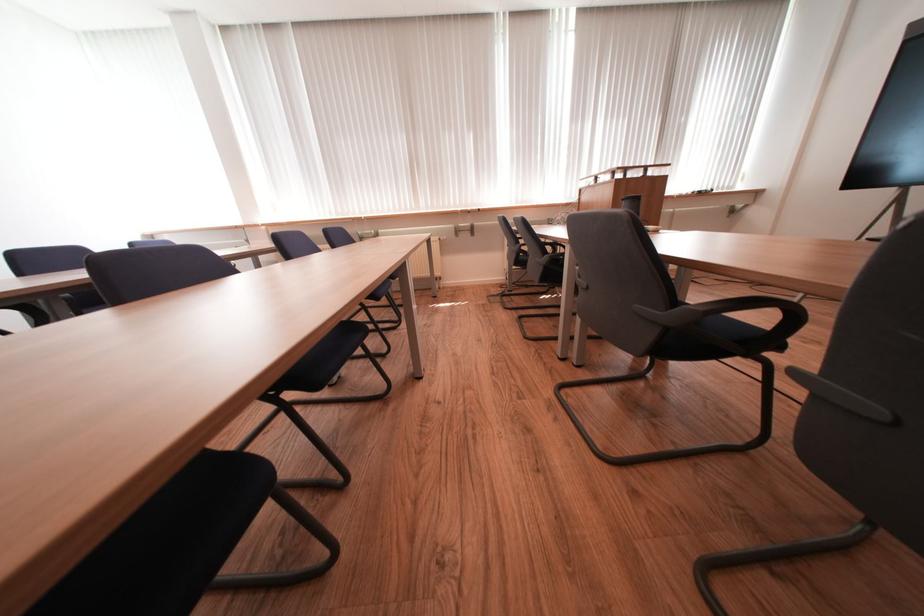
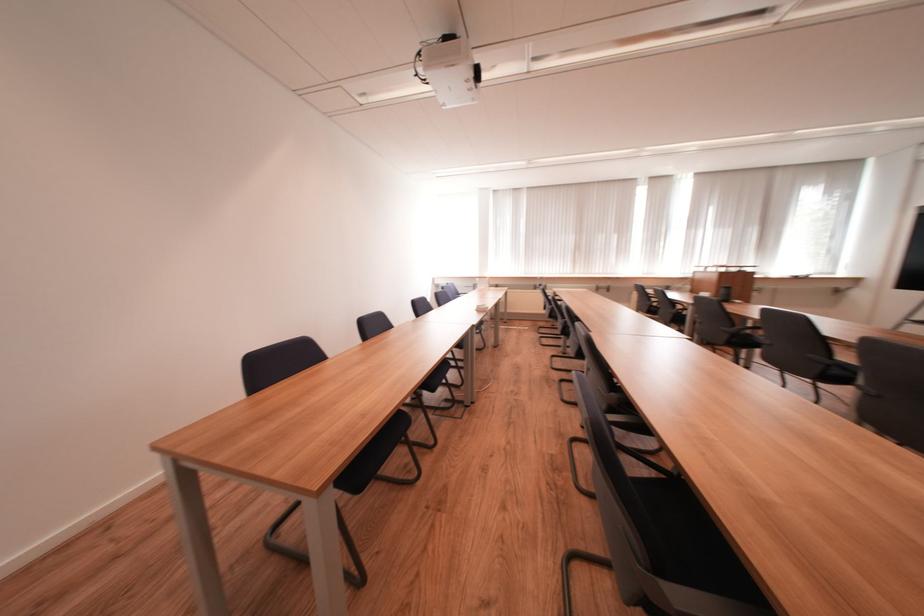
Based on the photo, in a continuous first-person perspective shot, in which direction is the camera moving?

The cameraman walked toward left, backward.